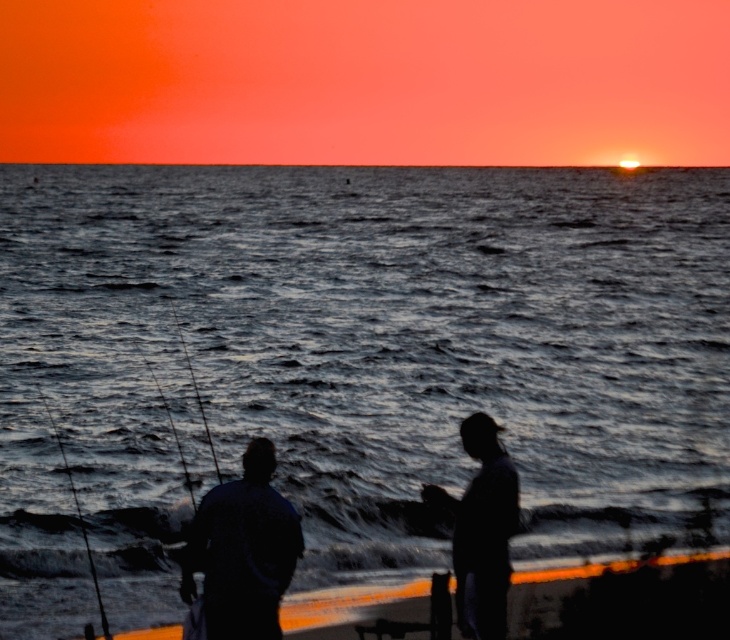
Question: Which point is closer to the camera?

Choices:
 (A) (65, 465)
 (B) (31, 179)

Answer: (A)

Question: Which point is closer to the camera?

Choices:
 (A) silhouette fishing rod at center
 (B) silhouette fishing rod at lower right
 (C) silhouette clothing at center
 (D) metallic fishing pole at left

Answer: (A)

Question: Can you confirm if dark gray water at center is positioned above silhouette clothing at center?

Choices:
 (A) yes
 (B) no

Answer: (A)

Question: Which point is farther from the camera taking this photo?

Choices:
 (A) (434, 490)
 (B) (110, 632)

Answer: (B)

Question: Does dark gray water at center have a smaller size compared to smooth black rod at left?

Choices:
 (A) yes
 (B) no

Answer: (B)

Question: Does silhouette clothing at center have a greater width compared to smooth black rod at left?

Choices:
 (A) yes
 (B) no

Answer: (B)